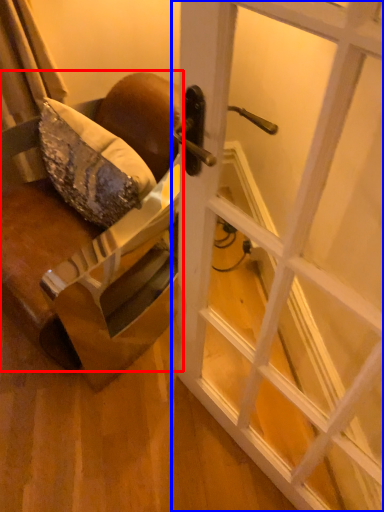
Question: Which point is further to the camera, chair (highlighted by a red box) or door (highlighted by a blue box)?

Choices:
 (A) chair
 (B) door

Answer: (A)